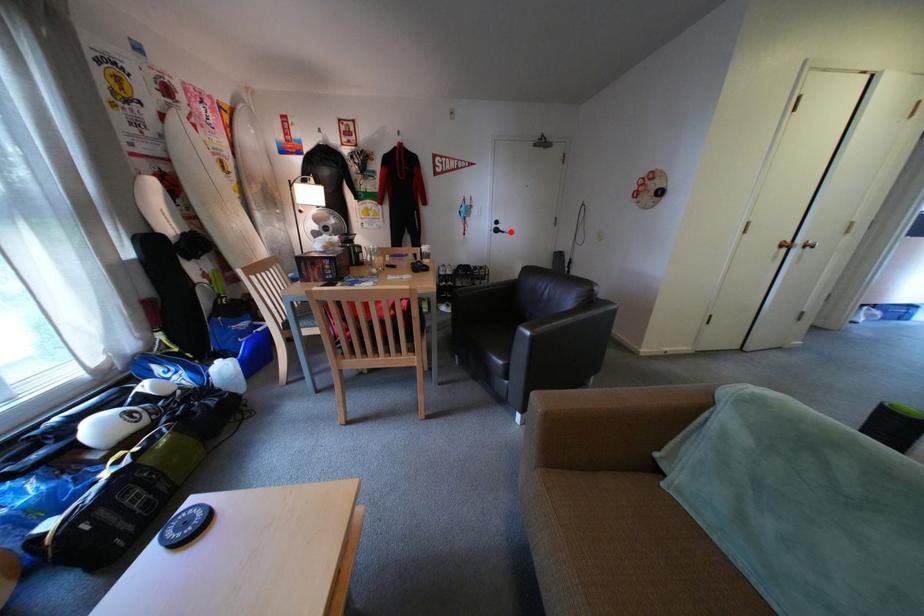
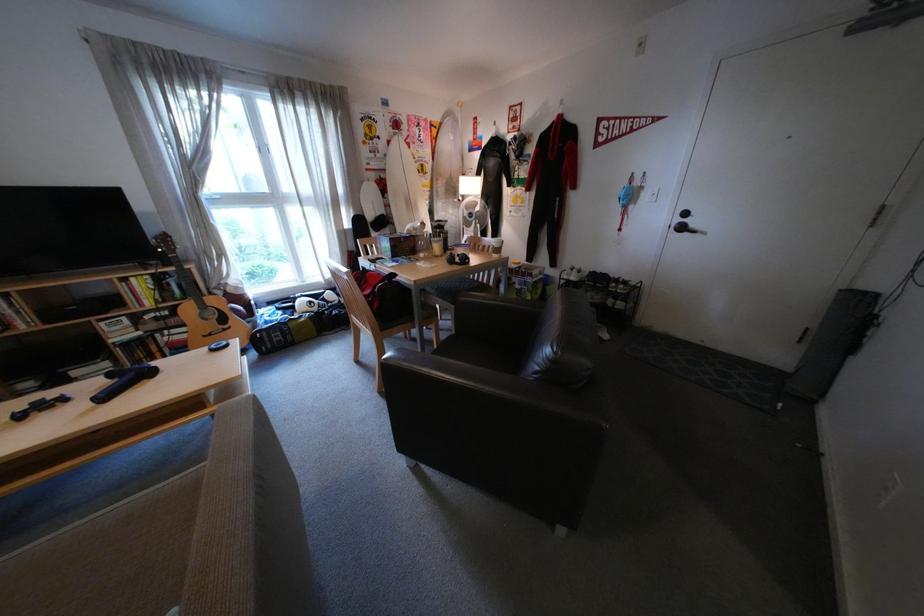
Where in the second image is the point corresponding to the highlighted location from the first image?

(696, 229)